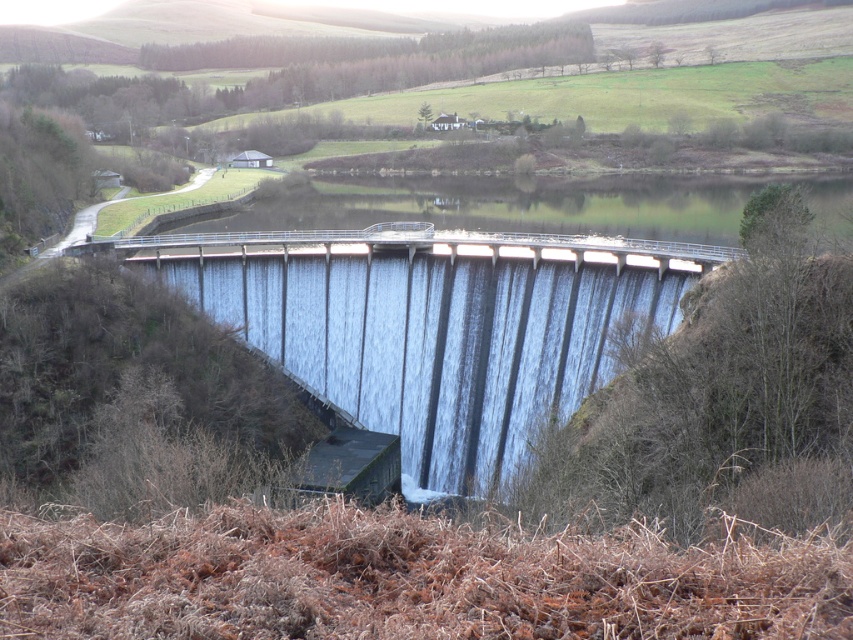
You are a safety inspector assessing the dam structure. You notice the smooth concrete dam at center and the clear water at center. Based on their positions, which one is situated lower in the scene?

The smooth concrete dam at center is located below clear water at center, so the dam is situated lower than the water in the scene.

You are a civil engineer inspecting the dam. You notice the smooth concrete dam at center and the clear water at center. Which one has a smaller size?

The smooth concrete dam at center has a smaller size compared to the clear water at center.